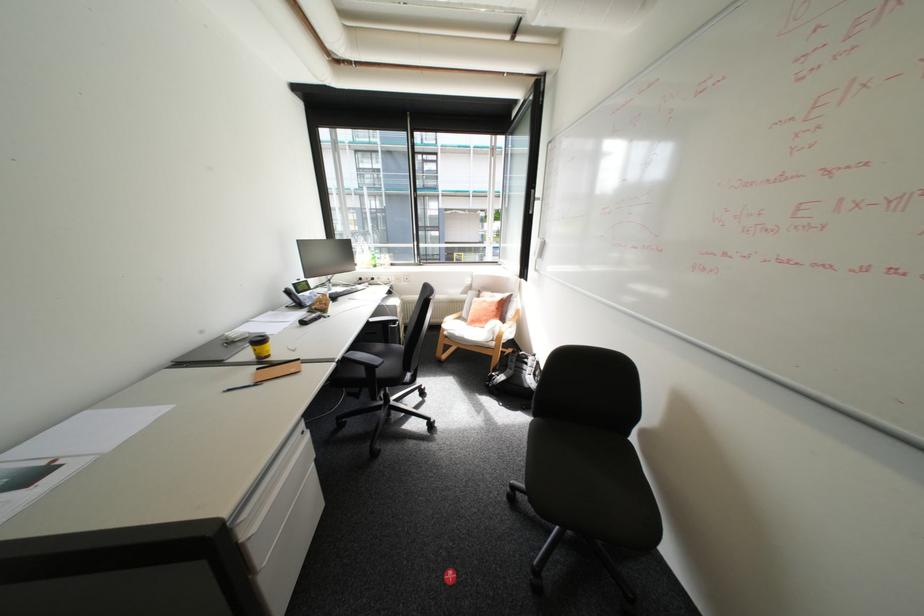
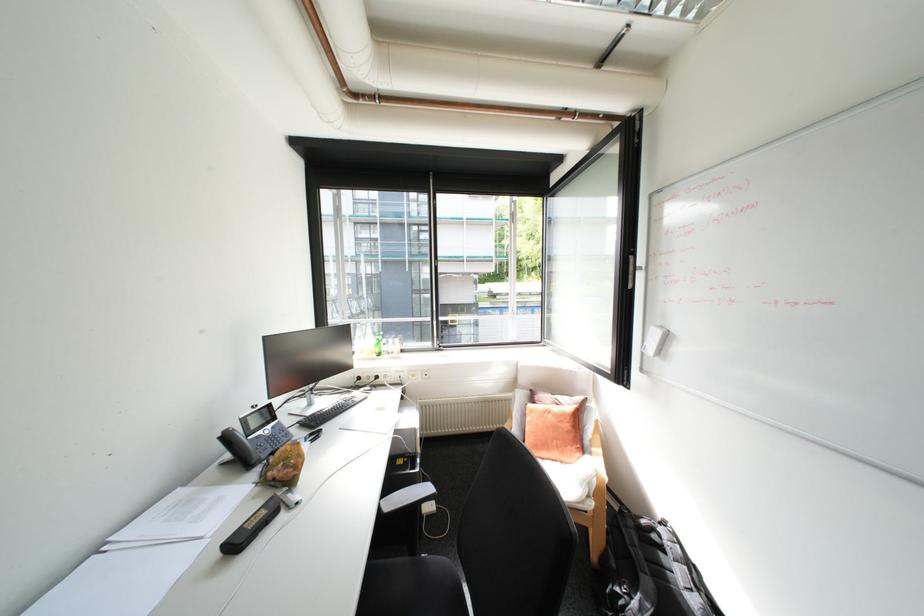
Locate, in the second image, the point that corresponds to [366,264] in the first image.

(362, 353)